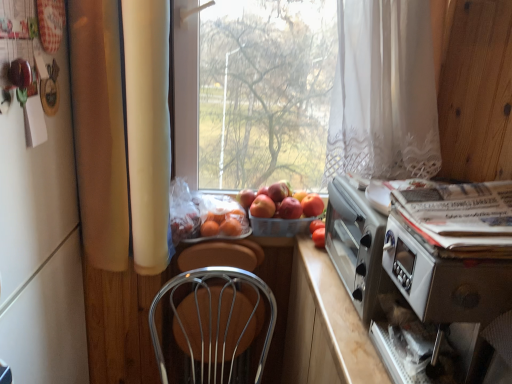
Question: Is metallic wire chair at center oriented towards plastic basket at center?

Choices:
 (A) no
 (B) yes

Answer: (A)

Question: Is metallic wire chair at center positioned beyond the bounds of plastic basket at center?

Choices:
 (A) no
 (B) yes

Answer: (B)

Question: From a real-world perspective, is metallic wire chair at center beneath plastic basket at center?

Choices:
 (A) no
 (B) yes

Answer: (B)

Question: Can you confirm if metallic wire chair at center is wider than plastic basket at center?

Choices:
 (A) no
 (B) yes

Answer: (B)

Question: Can you confirm if metallic wire chair at center is taller than plastic basket at center?

Choices:
 (A) yes
 (B) no

Answer: (A)

Question: From the image's perspective, does metallic wire chair at center appear lower than plastic basket at center?

Choices:
 (A) yes
 (B) no

Answer: (A)

Question: Are white glossy fridge at left and red matte apple at center, the fourth apple in the left-to-right sequence, making contact?

Choices:
 (A) yes
 (B) no

Answer: (B)

Question: Is white glossy fridge at left positioned behind red matte apple at center, the fourth apple in the left-to-right sequence?

Choices:
 (A) yes
 (B) no

Answer: (B)

Question: Is white glossy fridge at left positioned far away from red matte apple at center, acting as the first apple starting from the right?

Choices:
 (A) yes
 (B) no

Answer: (B)

Question: Can red matte apple at center, acting as the first apple starting from the right, be found inside white glossy fridge at left?

Choices:
 (A) yes
 (B) no

Answer: (B)

Question: Is white glossy fridge at left at the right side of red matte apple at center, acting as the first apple starting from the right?

Choices:
 (A) yes
 (B) no

Answer: (B)

Question: Is white glossy fridge at left oriented away from red matte apple at center, acting as the first apple starting from the right?

Choices:
 (A) no
 (B) yes

Answer: (A)

Question: Is red matte apple at center, the 2th apple viewed from the left, next to red matte apple at center, the second apple when ordered from right to left?

Choices:
 (A) no
 (B) yes

Answer: (B)